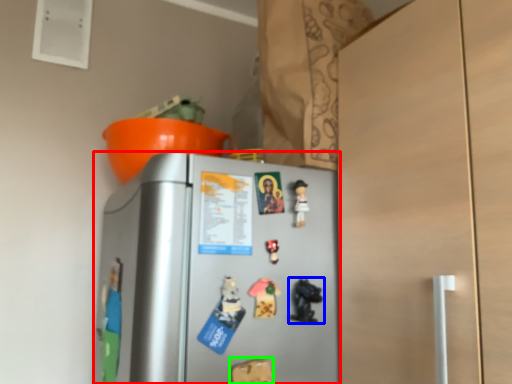
Question: Which object is the closest to the refrigerator (highlighted by a red box)? Choose among these: toy (highlighted by a blue box) or toy (highlighted by a green box).

Choices:
 (A) toy
 (B) toy

Answer: (A)